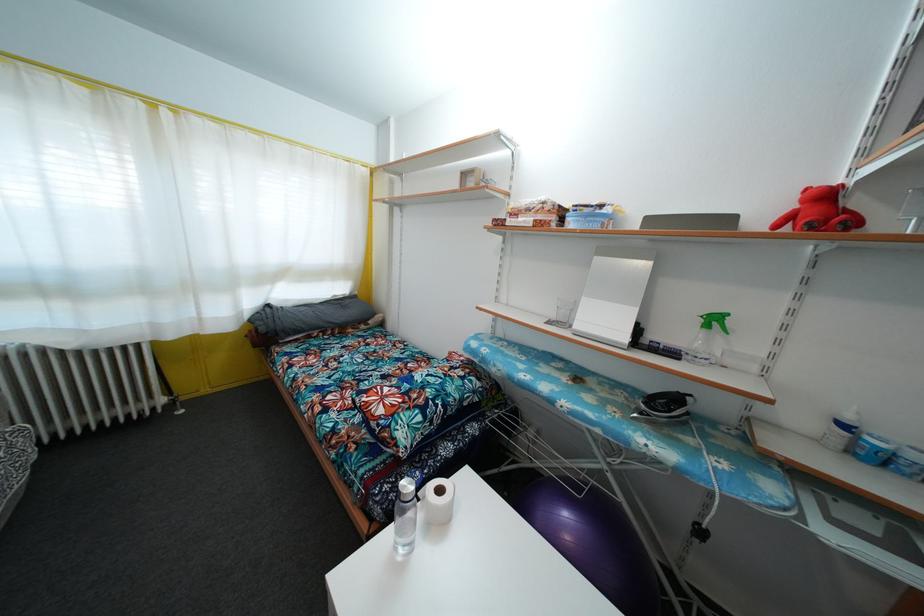
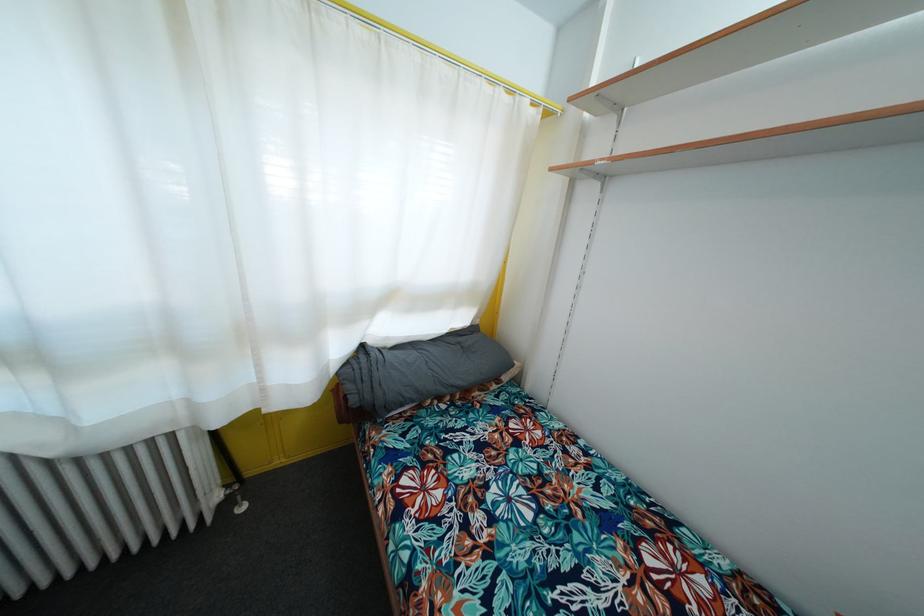
The point at (265, 336) is marked in the first image. Where is the corresponding point in the second image?

(358, 407)